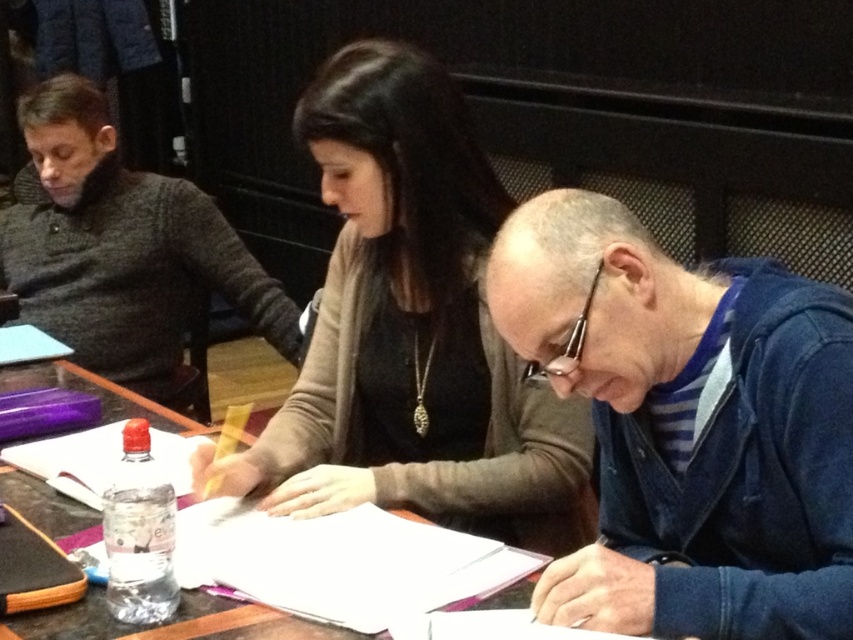
How far apart are blue denim jacket at lower right and dark gray sweater at left?

A distance of 4.55 feet exists between blue denim jacket at lower right and dark gray sweater at left.

Consider the image. Does blue denim jacket at lower right appear under dark gray sweater at left?

Correct, blue denim jacket at lower right is located below dark gray sweater at left.

Find the location of a particular element. The width and height of the screenshot is (853, 640). blue denim jacket at lower right is located at coordinates (689, 426).

From the picture: How far apart are matte black sweater at center and wooden table at center?

matte black sweater at center and wooden table at center are 18.51 inches apart from each other.

Is matte black sweater at center thinner than wooden table at center?

Indeed, matte black sweater at center has a lesser width compared to wooden table at center.

You are a GUI agent. You are given a task and a screenshot of the screen. Output one action in this format:
    pyautogui.click(x=<x>, y=<y>)
    Task: Click on the matte black sweater at center
    
    Given the screenshot: What is the action you would take?
    pyautogui.click(x=413, y=330)

Can you confirm if blue denim jacket at lower right is bigger than matte black sweater at center?

Incorrect, blue denim jacket at lower right is not larger than matte black sweater at center.

Is point (839, 563) behind point (421, 138)?

No, (839, 563) is in front of (421, 138).

The image size is (853, 640). I want to click on blue denim jacket at lower right, so click(x=689, y=426).